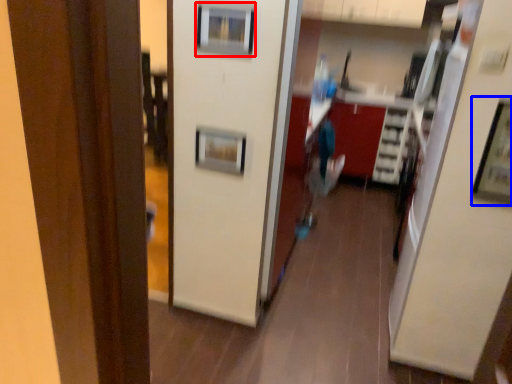
Question: Which object is closer to the camera taking this photo, picture frame (highlighted by a red box) or picture frame (highlighted by a blue box)?

Choices:
 (A) picture frame
 (B) picture frame

Answer: (B)